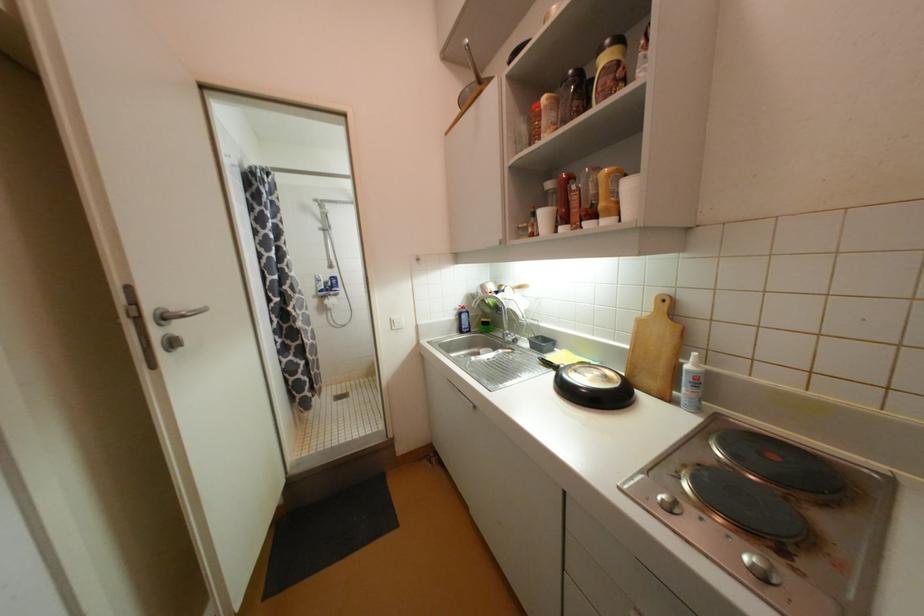
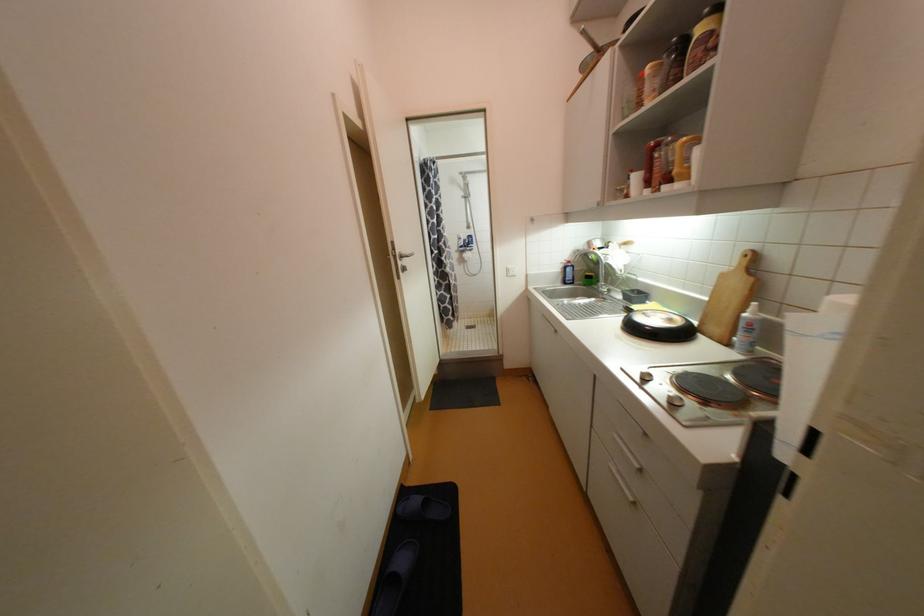
Find the pixel in the second image that matches point (633, 346) in the first image.

(712, 299)